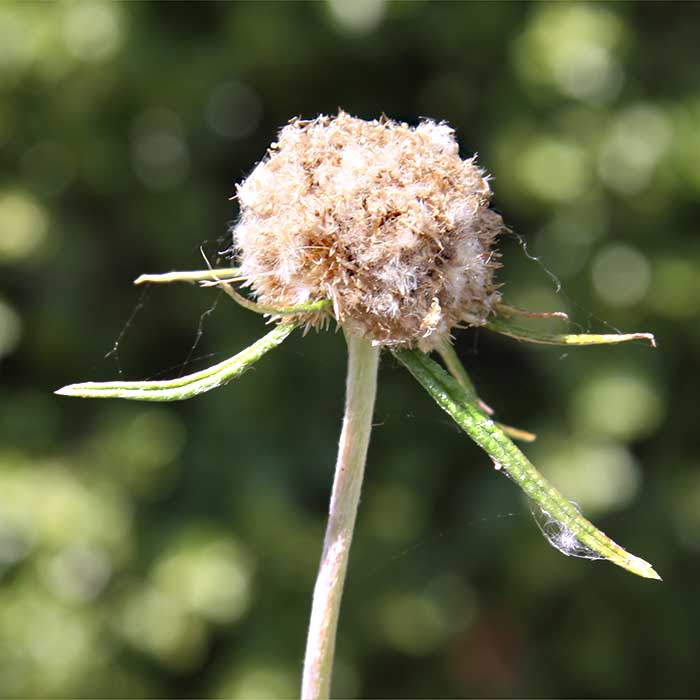
The height and width of the screenshot is (700, 700). In order to click on light source in this screenshot , I will do coord(356,164), coord(280,267), coord(327,567).